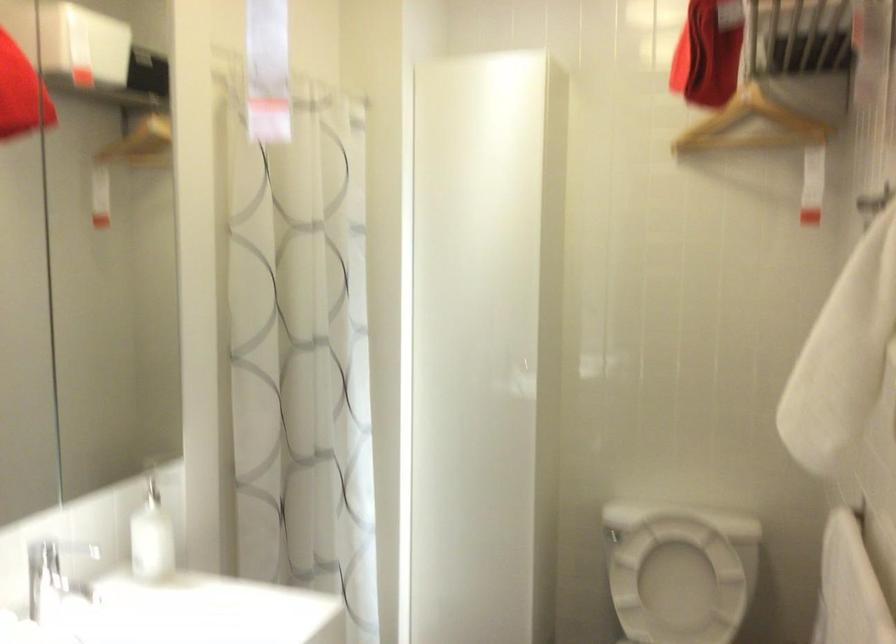
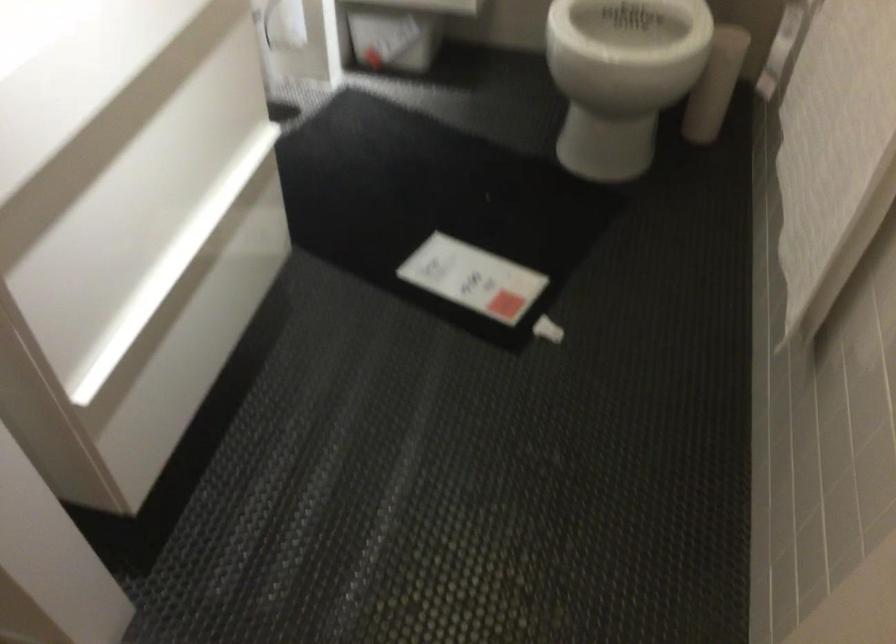
Question: How did the camera likely rotate?

Choices:
 (A) Left
 (B) Right
 (C) Up
 (D) Down

Answer: (D)